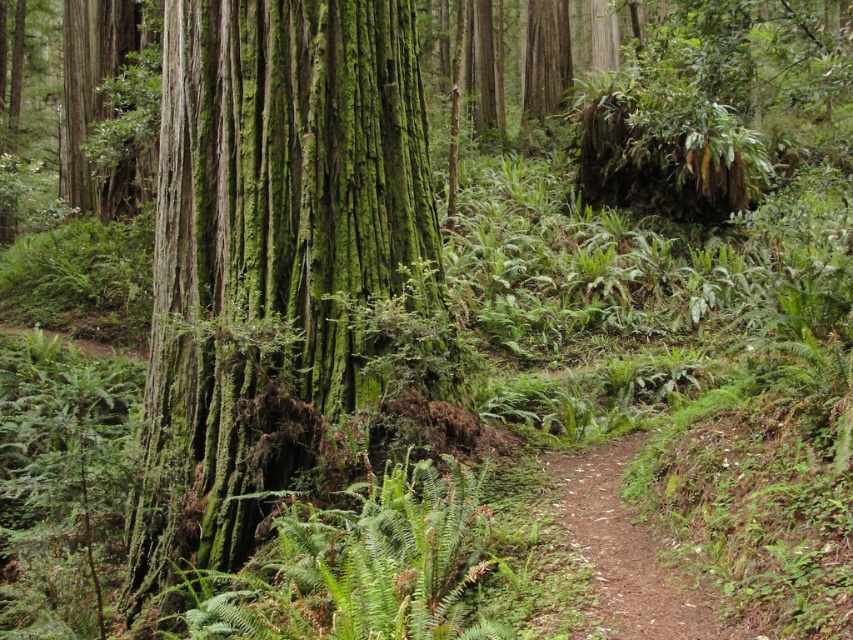
Question: Can you confirm if green mossy bark tree at center is thinner than brown dirt path at center?

Choices:
 (A) no
 (B) yes

Answer: (A)

Question: Can you confirm if green mossy bark tree at center is positioned to the right of brown dirt path at center?

Choices:
 (A) yes
 (B) no

Answer: (B)

Question: Does green mossy bark tree at center have a greater width compared to brown dirt path at center?

Choices:
 (A) no
 (B) yes

Answer: (B)